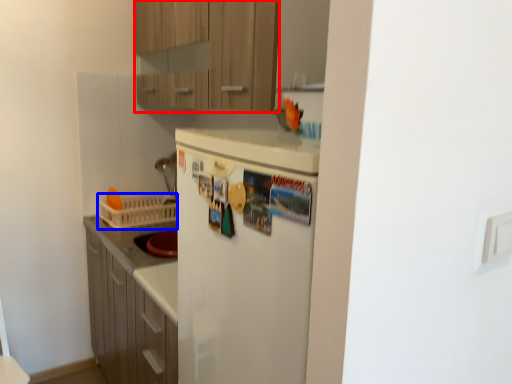
Question: Among these objects, which one is farthest to the camera, cabinetry (highlighted by a red box) or basket (highlighted by a blue box)?

Choices:
 (A) cabinetry
 (B) basket

Answer: (B)